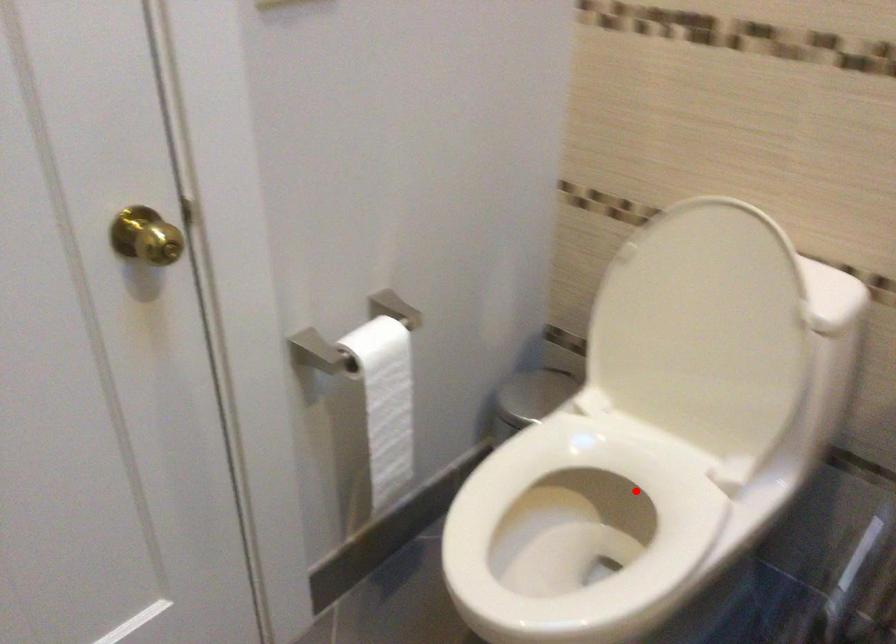
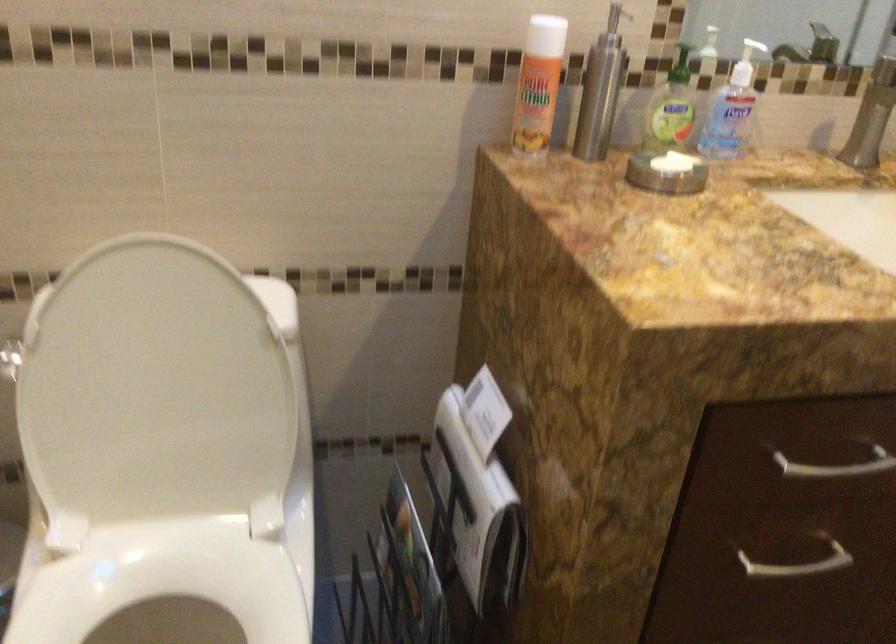
Where in the second image is the point corresponding to the highlighted location from the first image?

(166, 594)